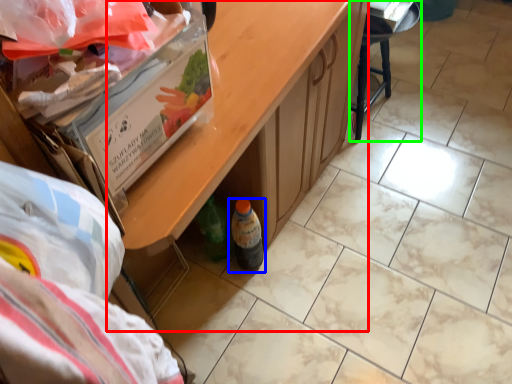
Question: Which object is the closest to the table (highlighted by a red box)? Choose among these: bottle (highlighted by a blue box) or furniture (highlighted by a green box).

Choices:
 (A) bottle
 (B) furniture

Answer: (A)